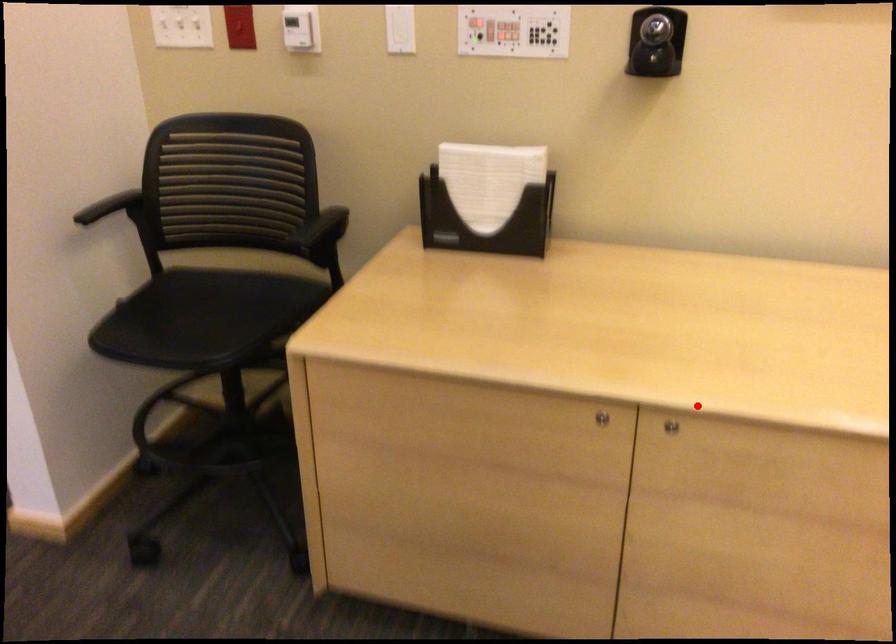
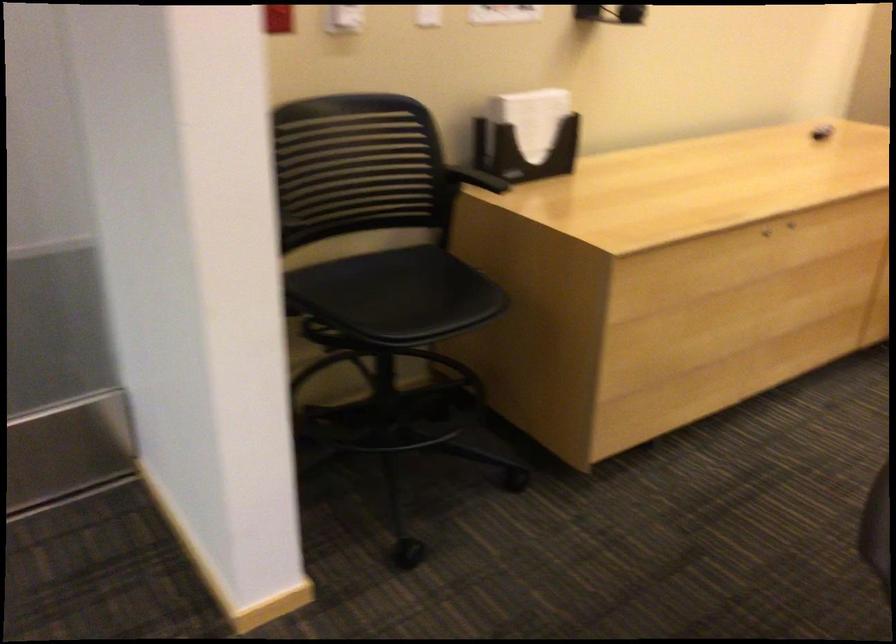
The point at the highlighted location is marked in the first image. Where is the corresponding point in the second image?

(790, 225)